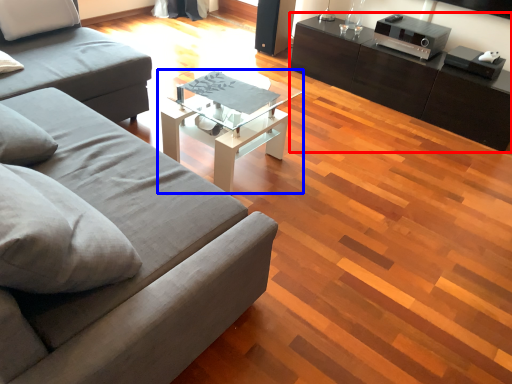
Question: Among these objects, which one is nearest to the camera, table (highlighted by a red box) or coffee table (highlighted by a blue box)?

Choices:
 (A) table
 (B) coffee table

Answer: (B)